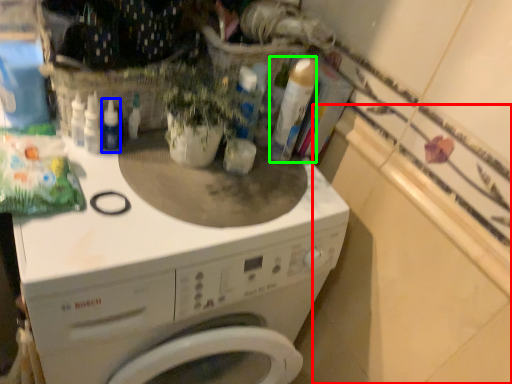
Question: Which is nearer to the counter top (highlighted by a red box)? bottle (highlighted by a blue box) or cleaning product (highlighted by a green box).

Choices:
 (A) bottle
 (B) cleaning product

Answer: (B)